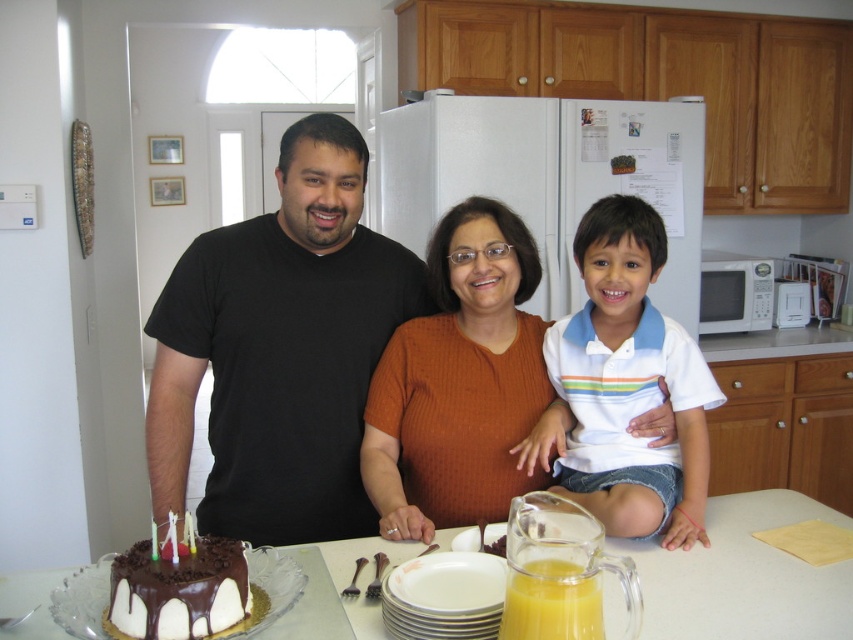
You are organizing the kitchen counter and need to place the orange ribbed sweater at center and the white glossy microwave at right. According to the current layout, which object is located to the left of the other?

The orange ribbed sweater at center is positioned on the left side of the white glossy microwave at right.

You are trying to decide which shirt to wear for a casual day out. Both the black matte shirt at center and the white cotton shirt at center are in your drawer. Based on their sizes, which one do you think would be more comfortable for layering under a jacket?

The black matte shirt at center might be wider than the white cotton shirt at center, so it could be more comfortable for layering under a jacket if a looser fit is preferred.